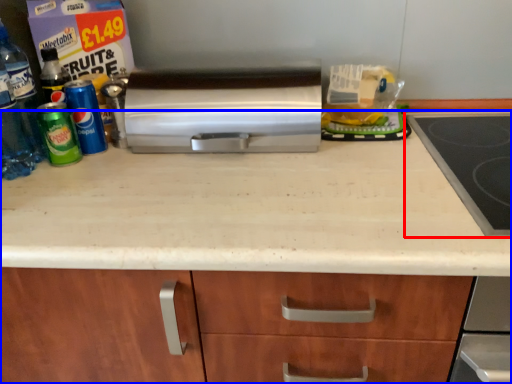
Question: Which object appears closest to the camera in this image, gas stove (highlighted by a red box) or countertop (highlighted by a blue box)?

Choices:
 (A) gas stove
 (B) countertop

Answer: (B)